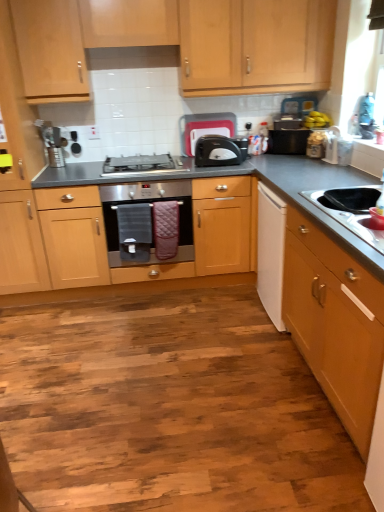
Describe the element at coordinates (204, 128) in the screenshot. I see `black plastic toaster at upper center, acting as the third appliance starting from the right` at that location.

Locate an element on the screen. The image size is (384, 512). black plastic toaster at upper center, acting as the third appliance starting from the right is located at coordinates (204, 128).

What do you see at coordinates (335, 323) in the screenshot?
I see `light wood cabinet at right, positioned as the 1th cabinetry in bottom-to-top order` at bounding box center [335, 323].

How much space does brushed metal toaster at center, placed as the 1th appliance when sorted from left to right, occupy vertically?

5.43 inches.

You are a GUI agent. You are given a task and a screenshot of the screen. Output one action in this format:
    pyautogui.click(x=<x>, y=<y>)
    Task: Click on the satin silver gas stove at center
    
    Given the screenshot: What is the action you would take?
    pos(144,165)

From the image's perspective, is black matte countertop at center located beneath black plastic toaster at upper center, acting as the third appliance starting from the right?

Yes, from the image's perspective, black matte countertop at center is below black plastic toaster at upper center, acting as the third appliance starting from the right.

From a real-world perspective, does black matte countertop at center stand above black plastic toaster at upper center, acting as the third appliance starting from the right?

Incorrect, from a real-world perspective, black matte countertop at center is lower than black plastic toaster at upper center, acting as the third appliance starting from the right.

Between black matte countertop at center and black plastic toaster at upper center, placed as the second appliance when sorted from left to right, which one has more height?

black matte countertop at center.

How many degrees apart are the facing directions of light wood cabinet at upper center, which is the second cabinetry in front-to-back order, and stainless steel oven at center?

The angle between the facing direction of light wood cabinet at upper center, which is the second cabinetry in front-to-back order, and the facing direction of stainless steel oven at center is 0.00104 degrees.

Consider the image. Are light wood cabinet at upper center, which is the second cabinetry in front-to-back order, and stainless steel oven at center beside each other?

No, light wood cabinet at upper center, which is the second cabinetry in front-to-back order, is not touching stainless steel oven at center.

Based on the photo, is light wood cabinet at upper center, the 2th cabinetry in the bottom-to-top sequence, wider than stainless steel oven at center?

No, light wood cabinet at upper center, the 2th cabinetry in the bottom-to-top sequence, is not wider than stainless steel oven at center.

From the image's perspective, would you say light wood cabinet at upper center, which ranks as the first cabinetry in back-to-front order, is positioned over stainless steel oven at center?

Yes.

Considering the relative positions of black plastic toaster at upper center, placed as the second appliance when sorted from left to right, and black plastic microwave at upper right, marked as the first appliance in a right-to-left arrangement, in the image provided, is black plastic toaster at upper center, placed as the second appliance when sorted from left to right, to the left or to the right of black plastic microwave at upper right, marked as the first appliance in a right-to-left arrangement,?

Clearly, black plastic toaster at upper center, placed as the second appliance when sorted from left to right, is on the left of black plastic microwave at upper right, marked as the first appliance in a right-to-left arrangement, in the image.

From the image's perspective, relative to black plastic microwave at upper right, marked as the first appliance in a right-to-left arrangement, is black plastic toaster at upper center, placed as the second appliance when sorted from left to right, above or below?

Clearly, from the image's perspective, black plastic toaster at upper center, placed as the second appliance when sorted from left to right, is above black plastic microwave at upper right, marked as the first appliance in a right-to-left arrangement.

Which object is wider, black plastic toaster at upper center, acting as the third appliance starting from the right, or black plastic microwave at upper right, marked as the first appliance in a right-to-left arrangement?

Wider between the two is black plastic microwave at upper right, marked as the first appliance in a right-to-left arrangement.

Would you say black plastic toaster at upper center, placed as the second appliance when sorted from left to right, is a long distance from black plastic microwave at upper right, acting as the 4th appliance starting from the left?

That's not correct — black plastic toaster at upper center, placed as the second appliance when sorted from left to right, is a little close to black plastic microwave at upper right, acting as the 4th appliance starting from the left.

Is stainless steel sink at lower right directly adjacent to stainless steel oven at center?

No.

Looking at this image, from a real-world perspective, does stainless steel sink at lower right sit lower than stainless steel oven at center?

No, from a real-world perspective, stainless steel sink at lower right is not under stainless steel oven at center.

Is stainless steel sink at lower right completely or partially outside of stainless steel oven at center?

That's correct, stainless steel sink at lower right is outside of stainless steel oven at center.

Could you tell me if light wood cabinet at right, which is the 2th cabinetry from top to bottom, is turned towards black plastic toaster at upper center, acting as the third appliance starting from the right?

No, light wood cabinet at right, which is the 2th cabinetry from top to bottom, does not turn towards black plastic toaster at upper center, acting as the third appliance starting from the right.

The height and width of the screenshot is (512, 384). Identify the location of the 3rd appliance to the left of the light wood cabinet at right, which ranks as the second cabinetry in back-to-front order, counting from the anchor's position. (204, 128).

Does light wood cabinet at right, which ranks as the second cabinetry in back-to-front order, have a smaller size compared to black plastic toaster at upper center, placed as the second appliance when sorted from left to right?

Actually, light wood cabinet at right, which ranks as the second cabinetry in back-to-front order, might be larger than black plastic toaster at upper center, placed as the second appliance when sorted from left to right.

From the image's perspective, does light wood cabinet at right, the first cabinetry when ordered from front to back, appear higher than black plastic toaster at upper center, acting as the third appliance starting from the right?

No, from the image's perspective, light wood cabinet at right, the first cabinetry when ordered from front to back, is not above black plastic toaster at upper center, acting as the third appliance starting from the right.

Considering the sizes of objects stainless steel sink at lower right and black plastic toaster at center, positioned as the 3th appliance in left-to-right order, in the image provided, who is bigger, stainless steel sink at lower right or black plastic toaster at center, positioned as the 3th appliance in left-to-right order,?

stainless steel sink at lower right is bigger.

Which is behind, stainless steel sink at lower right or black plastic toaster at center, positioned as the 2th appliance in right-to-left order?

Positioned behind is black plastic toaster at center, positioned as the 2th appliance in right-to-left order.

Can you confirm if stainless steel sink at lower right is shorter than black plastic toaster at center, positioned as the 2th appliance in right-to-left order?

Yes, stainless steel sink at lower right is shorter than black plastic toaster at center, positioned as the 2th appliance in right-to-left order.

Which of these two, satin black toaster at center or brushed metal toaster at center, which appears as the fourth appliance when viewed from the right, is wider?

Wider between the two is satin black toaster at center.

Measure the distance between satin black toaster at center and brushed metal toaster at center, which appears as the fourth appliance when viewed from the right.

satin black toaster at center is 1.13 meters away from brushed metal toaster at center, which appears as the fourth appliance when viewed from the right.

Is point (227, 160) in front of point (56, 164)?

Yes, point (227, 160) is in front of point (56, 164).

Considering the relative sizes of satin black toaster at center and brushed metal toaster at center, placed as the 1th appliance when sorted from left to right, in the image provided, is satin black toaster at center shorter than brushed metal toaster at center, placed as the 1th appliance when sorted from left to right,?

No.

From a real-world perspective, starting from the black matte countertop at center, which appliance is the 4th one vertically above it? Please provide its 2D coordinates.

[(204, 128)]

Where is `home appliance below the light wood cabinet at upper center, which is the second cabinetry in front-to-back order (from the image's perspective)`? The image size is (384, 512). home appliance below the light wood cabinet at upper center, which is the second cabinetry in front-to-back order (from the image's perspective) is located at coordinates (150, 215).

Estimate the real-world distances between objects in this image. Which object is closer to stainless steel sink at lower right, light wood cabinet at upper center, which is the second cabinetry in front-to-back order, or black plastic microwave at upper right, acting as the 4th appliance starting from the left?

The object closer to stainless steel sink at lower right is black plastic microwave at upper right, acting as the 4th appliance starting from the left.

Looking at the image, which one is located closer to satin black toaster at center, black plastic microwave at upper right, acting as the 4th appliance starting from the left, or white matte drawer at right?

black plastic microwave at upper right, acting as the 4th appliance starting from the left, is positioned closer to the anchor satin black toaster at center.

From the image, which object appears to be farther from black plastic toaster at upper center, acting as the third appliance starting from the right, black matte countertop at center or satin silver gas stove at center?

Among the two, black matte countertop at center is located further to black plastic toaster at upper center, acting as the third appliance starting from the right.

Estimate the real-world distances between objects in this image. Which object is further from brushed metal toaster at center, placed as the 1th appliance when sorted from left to right, satin black toaster at center or black plastic microwave at upper right, acting as the 4th appliance starting from the left?

black plastic microwave at upper right, acting as the 4th appliance starting from the left, is further to brushed metal toaster at center, placed as the 1th appliance when sorted from left to right.

From the picture: Based on their spatial positions, is stainless steel oven at center or light wood cabinet at right, the first cabinetry when ordered from front to back, closer to black plastic toaster at upper center, placed as the second appliance when sorted from left to right?

Among the two, stainless steel oven at center is located nearer to black plastic toaster at upper center, placed as the second appliance when sorted from left to right.

Considering their positions, is light wood cabinet at upper center, the 1th cabinetry positioned from the top, positioned closer to satin silver gas stove at center than stainless steel oven at center?

stainless steel oven at center.

Considering their positions, is white matte drawer at right positioned closer to satin silver gas stove at center than black matte countertop at center?

black matte countertop at center.

From the image, which object appears to be farther from black plastic microwave at upper right, acting as the 4th appliance starting from the left, black matte countertop at center or stainless steel sink at lower right?

stainless steel sink at lower right.

At what (x,y) coordinates should I click in order to perform the action: click on home appliance between stainless steel sink at lower right and satin black toaster at center along the z-axis. Please return your answer as a coordinate pair (x, y). The image size is (384, 512). Looking at the image, I should click on (150, 215).

The image size is (384, 512). In order to click on drawer between light wood cabinet at right, the first cabinetry when ordered from front to back, and satin black toaster at center, along the z-axis in this screenshot , I will do `click(339, 263)`.

I want to click on gas stove between brushed metal toaster at center, placed as the 1th appliance when sorted from left to right, and light wood cabinet at right, the first cabinetry when ordered from front to back, so click(144, 165).

Find the location of `home appliance positioned between light wood cabinet at right, which is the 2th cabinetry from top to bottom, and satin silver gas stove at center from near to far`. home appliance positioned between light wood cabinet at right, which is the 2th cabinetry from top to bottom, and satin silver gas stove at center from near to far is located at coordinates (150, 215).